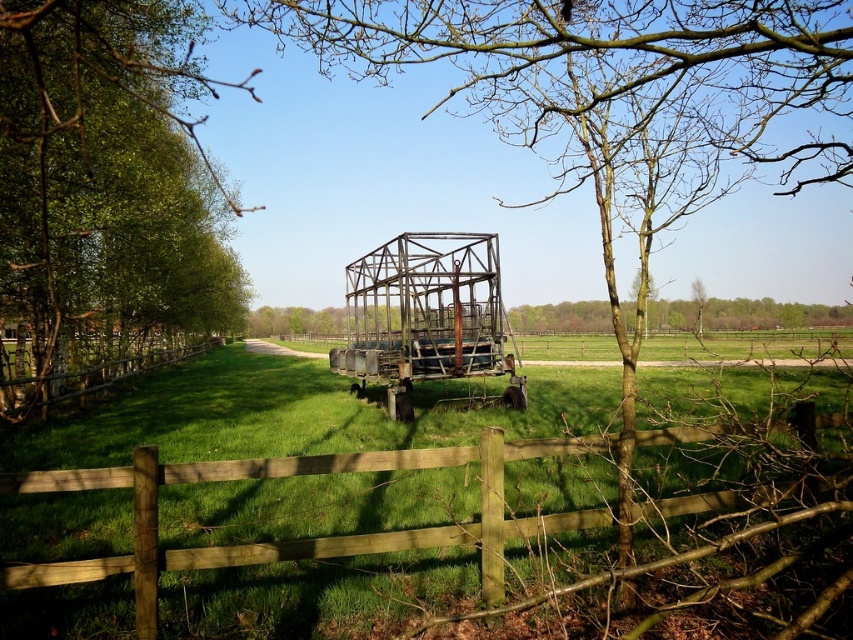
Question: Which object is closer to the camera taking this photo?

Choices:
 (A) green leafy tree at left
 (B) bare branches at center
 (C) brown wooden fence at left
 (D) brown wooden fence at center

Answer: (A)

Question: Among these points, which one is nearest to the camera?

Choices:
 (A) (485, 566)
 (B) (6, 100)
 (C) (474, 108)

Answer: (A)

Question: Is green leafy tree at left in front of brown wooden fence at left?

Choices:
 (A) yes
 (B) no

Answer: (A)

Question: Among these objects, which one is nearest to the camera?

Choices:
 (A) green leafy tree at left
 (B) brown wooden fence at left
 (C) bare branches at center

Answer: (A)

Question: Observing the image, what is the correct spatial positioning of bare branches at center in reference to brown wooden fence at center?

Choices:
 (A) right
 (B) left

Answer: (A)

Question: Does bare branches at center have a greater width compared to brown wooden fence at left?

Choices:
 (A) yes
 (B) no

Answer: (A)